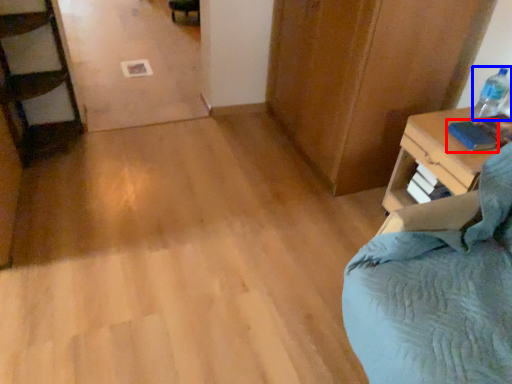
Question: Among these objects, which one is farthest to the camera, book (highlighted by a red box) or bottle (highlighted by a blue box)?

Choices:
 (A) book
 (B) bottle

Answer: (B)